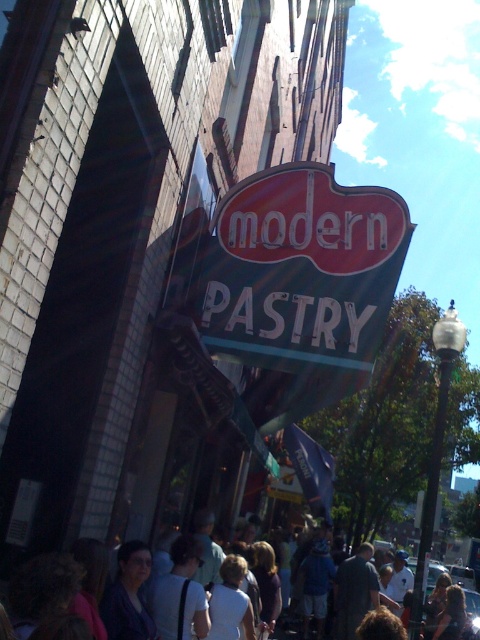
You are a window cleaner standing in front of the building. You need to clean both the red plastic sign at center and the white cotton shirt at center. Which object should you clean first if you want to start with the one that takes less time due to its size?

The red plastic sign at center occupies less space than the white cotton shirt at center, so it would take less time to clean. Therefore, you should start with the red plastic sign at center.

Based on the photo, you are a city planner reviewing a blueprint and need to note the exact coordinates of the red plastic sign at center. What are its coordinates?

The red plastic sign at center is located at point (301, 269).